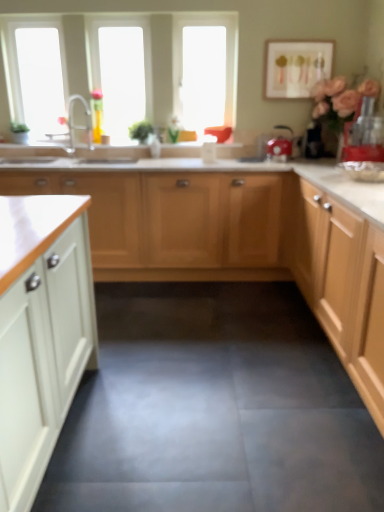
The width and height of the screenshot is (384, 512). Find the location of `vacant area on top of transparent glass window at upper center (from a real-world perspective)`. vacant area on top of transparent glass window at upper center (from a real-world perspective) is located at coordinates (117, 17).